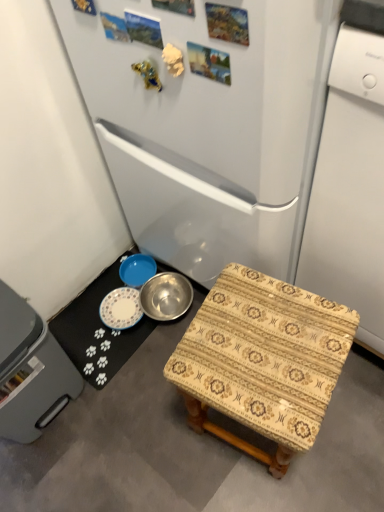
Identify the location of free spot to the right of gray plastic dishwasher at lower left. The image size is (384, 512). (132, 410).